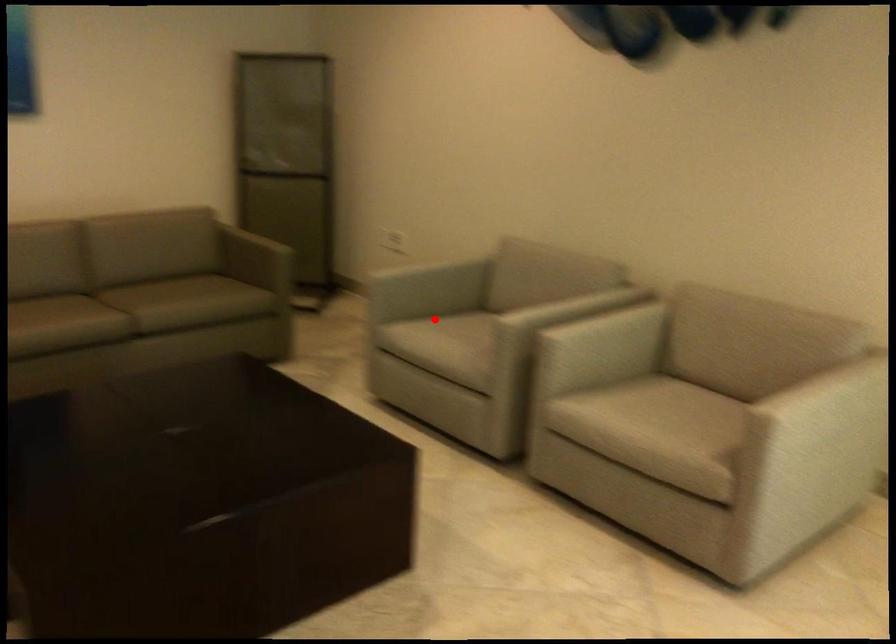
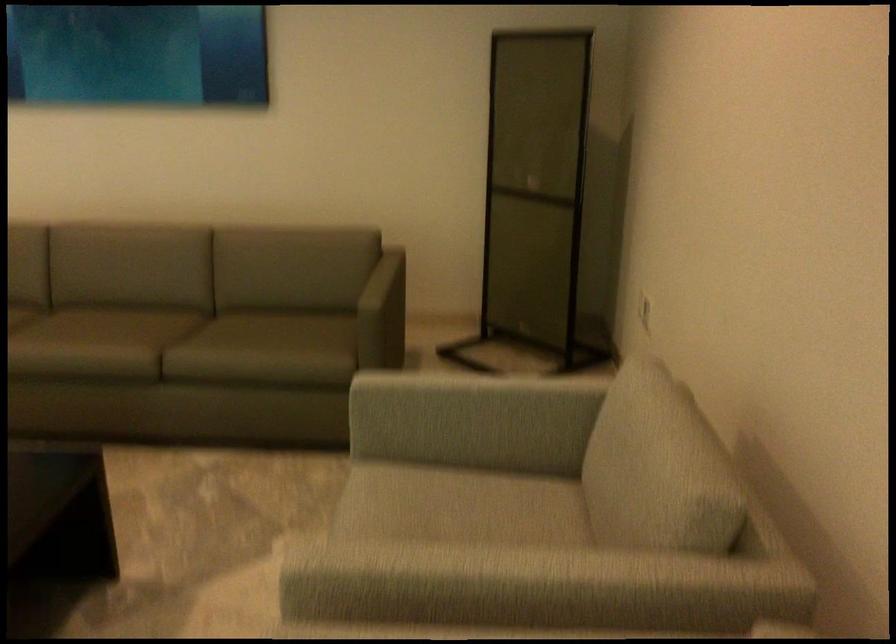
Question: I am providing you with two images of the same scene from different viewpoints. Given a red point in image1, look at the same physical point in image2. Is it:

Choices:
 (A) Closer to the viewpoint
 (B) Farther from the viewpoint

Answer: (A)